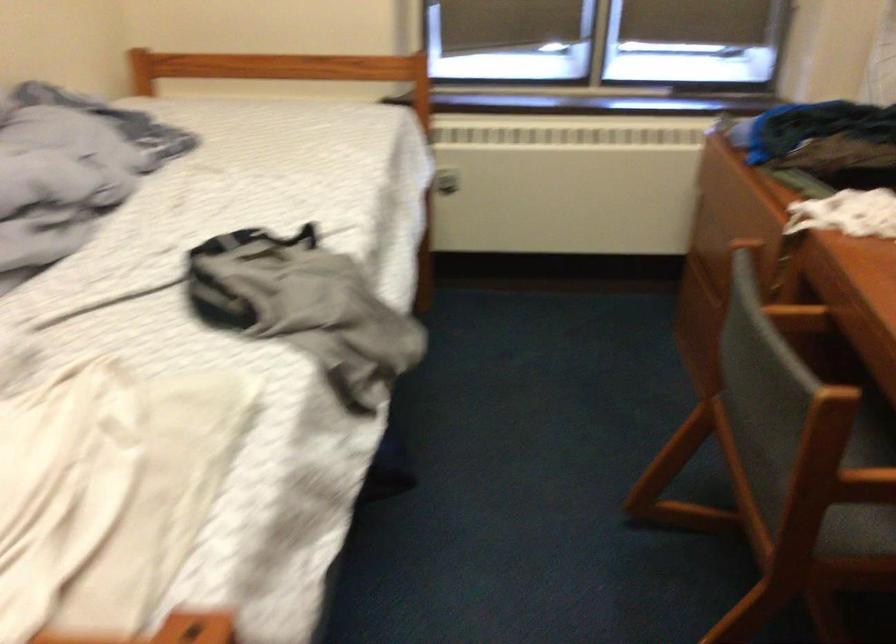
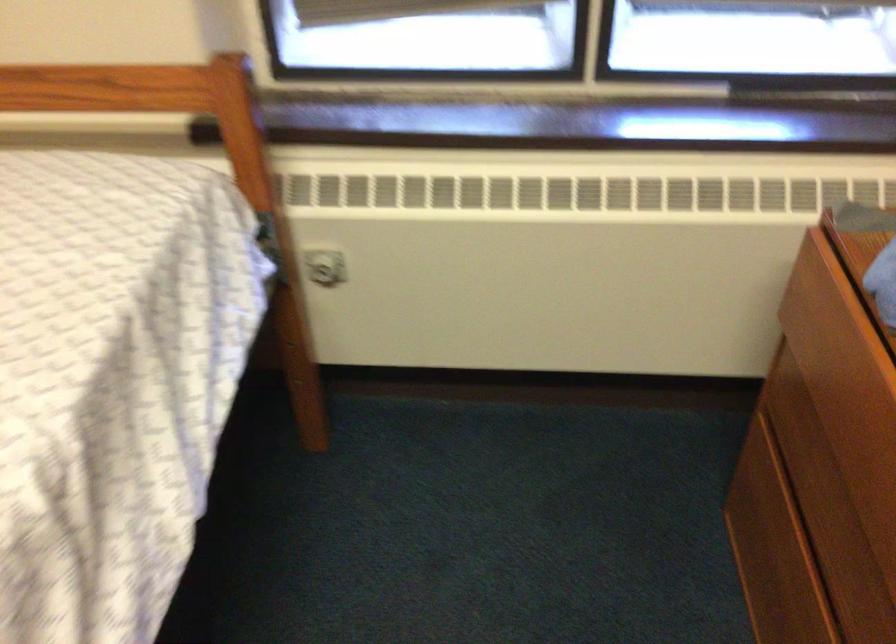
Find the pixel in the second image that matches pixel 449 176 in the first image.

(323, 267)